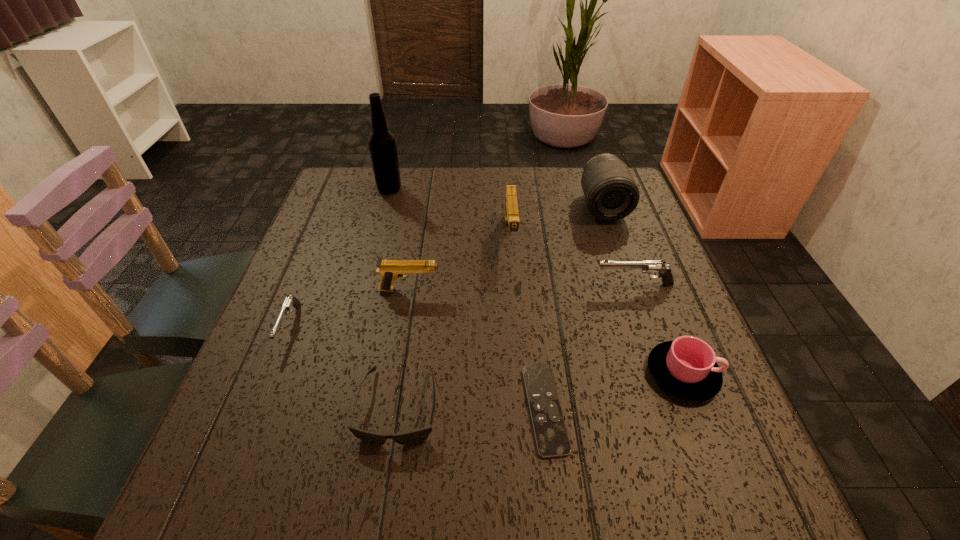
The image size is (960, 540). What are the coordinates of `free space between the pink cup and the shortest pistol` in the screenshot? It's located at (486, 350).

This screenshot has width=960, height=540. I want to click on vacant area that lies between the pink cup and the second pistol from left to right, so click(545, 332).

This screenshot has height=540, width=960. I want to click on vacant area that lies between the farthest pistol and the cup, so click(596, 305).

This screenshot has height=540, width=960. Find the location of `free space between the sunglasses and the second object from left to right`. free space between the sunglasses and the second object from left to right is located at coordinates (394, 298).

Locate an element on the screen. vacant space that's between the farther silver pistol and the right tan pistol is located at coordinates (572, 260).

You are a GUI agent. You are given a task and a screenshot of the screen. Output one action in this format:
    pyautogui.click(x=<x>, y=<y>)
    Task: Click on the free space between the sunglasses and the second object from left to right
    This screenshot has width=960, height=540.
    Given the screenshot: What is the action you would take?
    pyautogui.click(x=394, y=298)

Locate an element on the screen. Image resolution: width=960 pixels, height=540 pixels. vacant area that lies between the third shortest object and the shortest object is located at coordinates (418, 367).

Identify the location of vacant region between the second object from left to right and the right tan pistol. (450, 212).

Identify the location of free area in between the remote control and the bigger silver pistol. This screenshot has height=540, width=960. (589, 347).

Locate which object ranks fourth in proximity to the remote control. Please provide its 2D coordinates. Your answer should be formatted as a tuple, i.e. [(x, y)], where the tuple contains the x and y coordinates of a point satisfying the conditions above.

[(390, 270)]